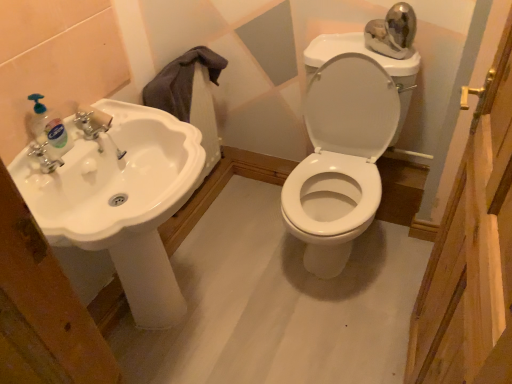
Locate an element on the screen. This screenshot has height=384, width=512. free space in front of translucent plastic soap dispenser at left is located at coordinates [45, 175].